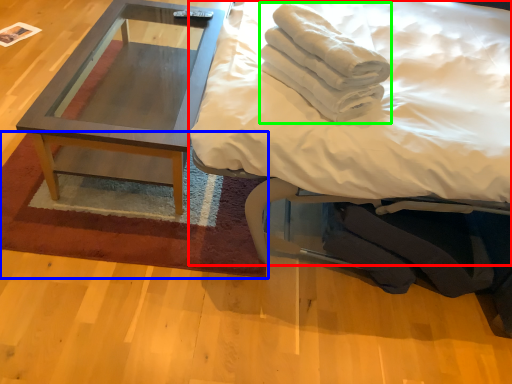
Question: Which object is positioned closest to bed (highlighted by a red box)? Select from mat (highlighted by a blue box) and material (highlighted by a green box).

Choices:
 (A) mat
 (B) material

Answer: (B)